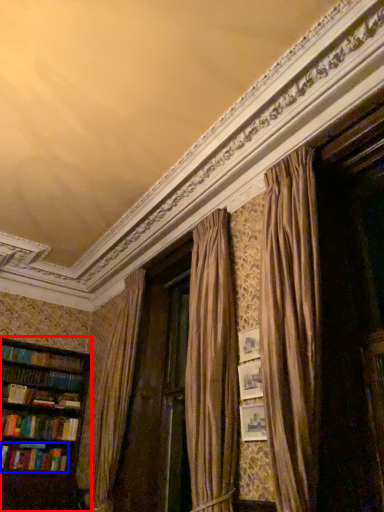
Question: Which object appears closest to the camera in this image, bookcase (highlighted by a red box) or book (highlighted by a blue box)?

Choices:
 (A) bookcase
 (B) book

Answer: (A)